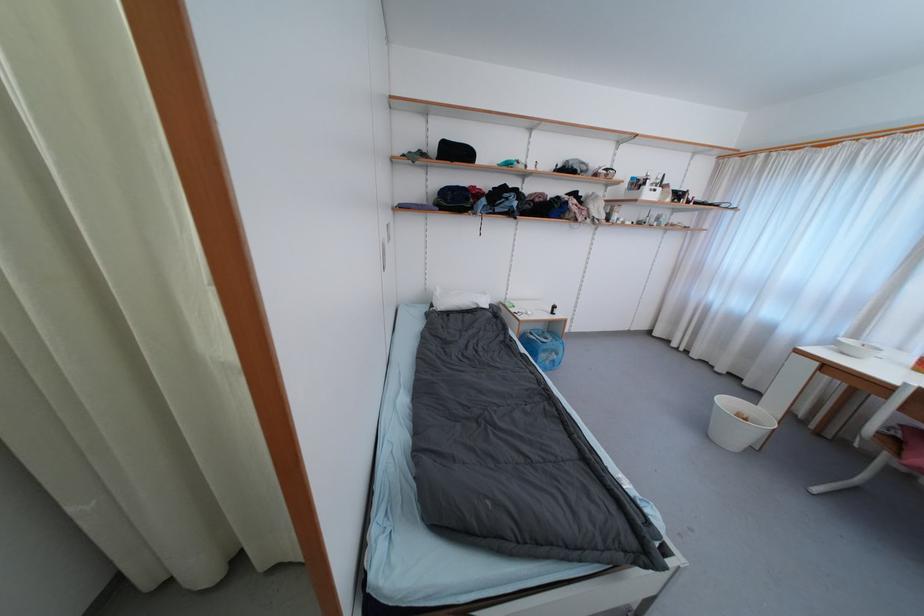
Locate an element on the screen. Image resolution: width=924 pixels, height=616 pixels. chair sitting surface is located at coordinates (910, 435).